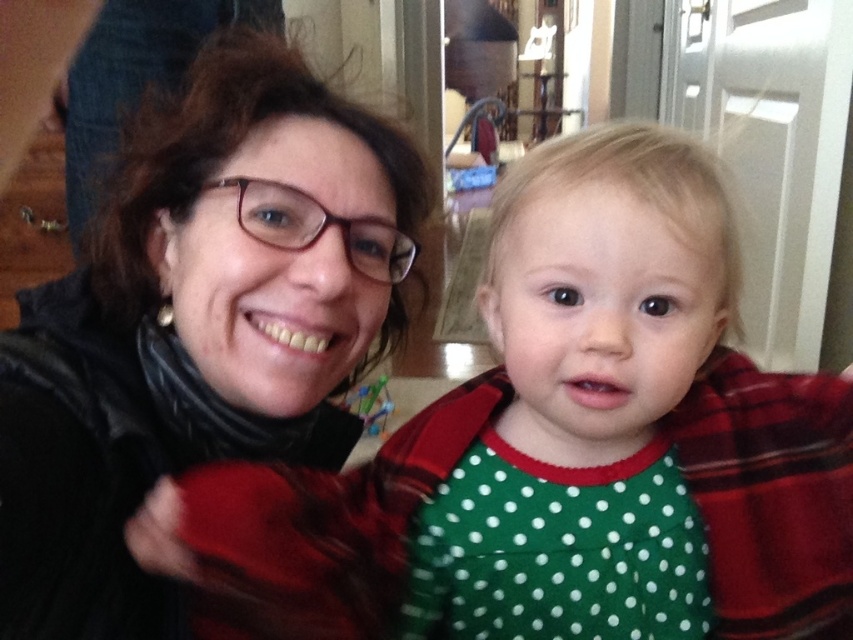
Question: Is matte black scarf at left positioned before matte black glasses at upper center?

Choices:
 (A) no
 (B) yes

Answer: (B)

Question: Which point appears farthest from the camera in this image?

Choices:
 (A) (177, 497)
 (B) (114, 42)
 (C) (231, 109)

Answer: (B)

Question: Can you confirm if green dotted fabric at center is smaller than matte black scarf at left?

Choices:
 (A) no
 (B) yes

Answer: (B)

Question: Which point appears farthest from the camera in this image?

Choices:
 (A) click(267, 404)
 (B) click(114, 36)
 (C) click(583, 132)

Answer: (B)

Question: Which point is closer to the camera?

Choices:
 (A) (80, 547)
 (B) (88, 45)
 (C) (822, 605)

Answer: (A)

Question: Can you confirm if green dotted fabric at center is positioned above matte black glasses at upper center?

Choices:
 (A) yes
 (B) no

Answer: (B)